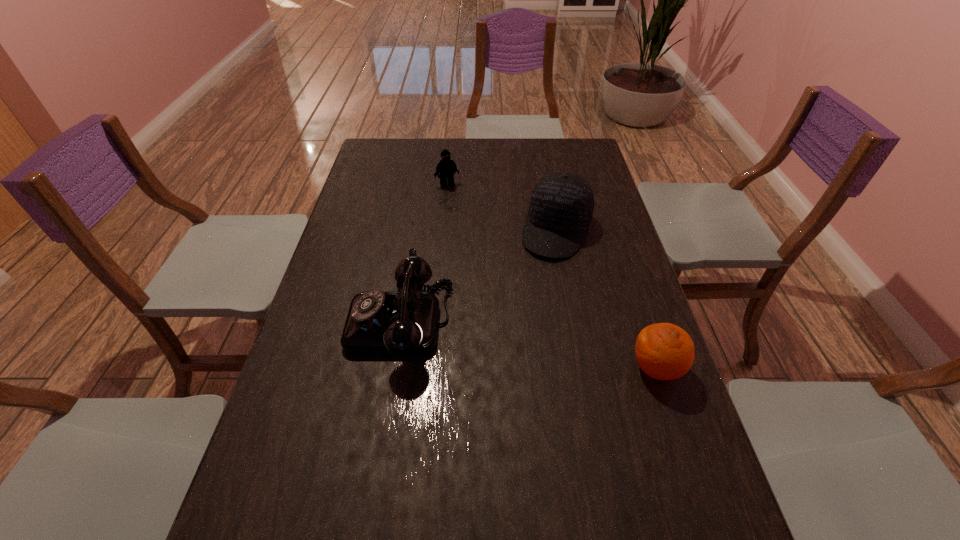
The image size is (960, 540). Find the location of `vacant space on the desktop that is between the telephone and the orange and is positioned on the face of the Lego`. vacant space on the desktop that is between the telephone and the orange and is positioned on the face of the Lego is located at coordinates (539, 347).

This screenshot has height=540, width=960. What are the coordinates of `free space on the desktop that is between the telephone and the orange and is positioned at the front of the second farthest object where the brim is located` in the screenshot? It's located at (511, 342).